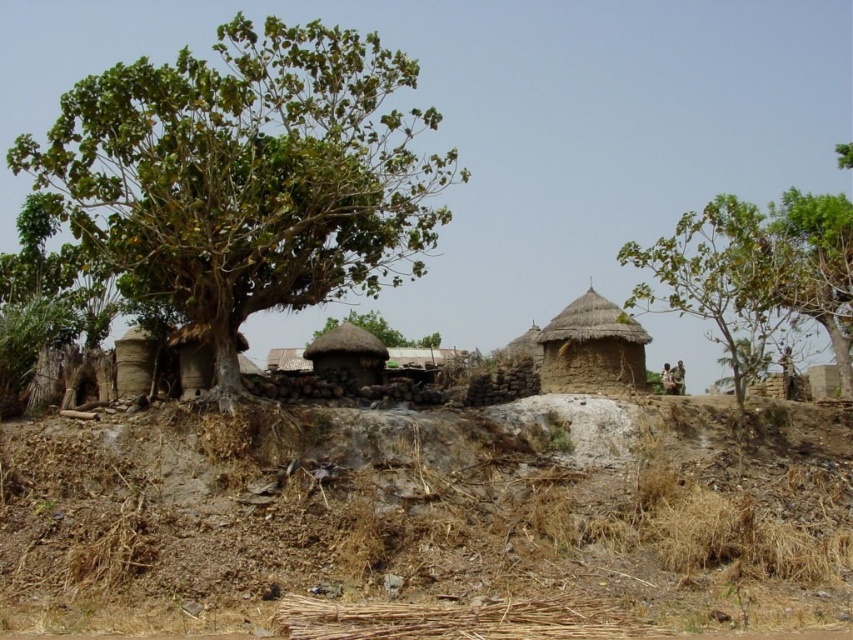
Question: Which point appears farthest from the camera in this image?

Choices:
 (A) (849, 298)
 (B) (339, 324)

Answer: (B)

Question: Can you confirm if green leafy tree at upper right is positioned below green thatch hut at center?

Choices:
 (A) yes
 (B) no

Answer: (B)

Question: Which of the following is the closest to the observer?

Choices:
 (A) (225, 536)
 (B) (392, 342)
 (C) (694, 232)

Answer: (A)

Question: Is green leafy tree at upper right closer to camera compared to thatched brown hut at center?

Choices:
 (A) yes
 (B) no

Answer: (A)

Question: Can you confirm if green leafy tree at left is positioned to the right of green thatch hut at center?

Choices:
 (A) yes
 (B) no

Answer: (B)

Question: Which of these objects is positioned closest to the green leafy tree at left?

Choices:
 (A) green leafy tree at upper right
 (B) brown soil at lower center

Answer: (B)